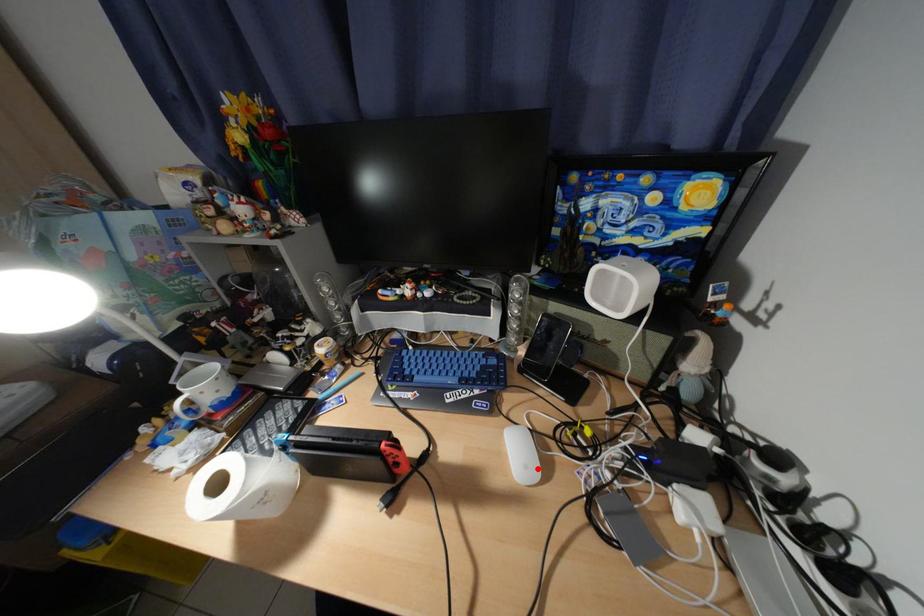
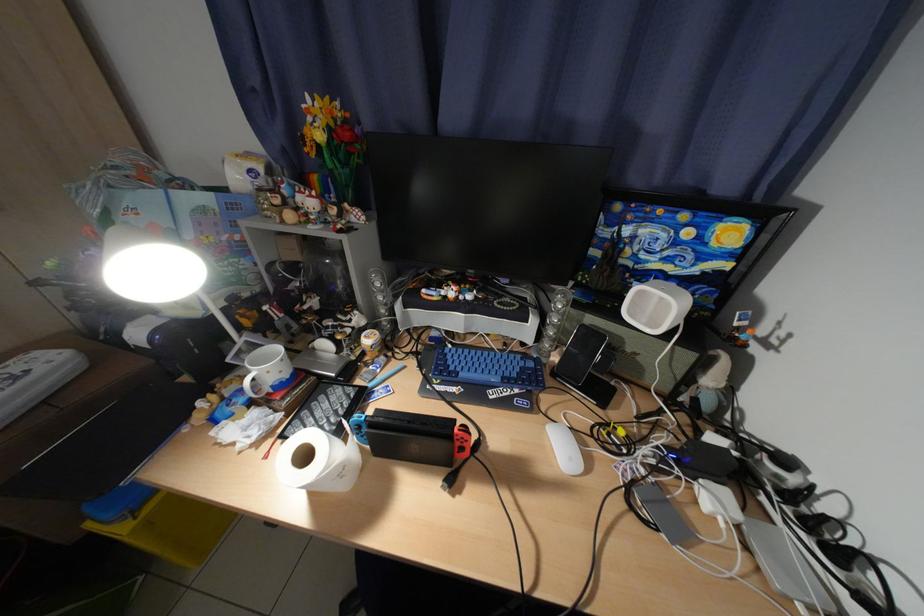
In the second image, find the point that corresponds to the highlighted location in the first image.

(582, 460)